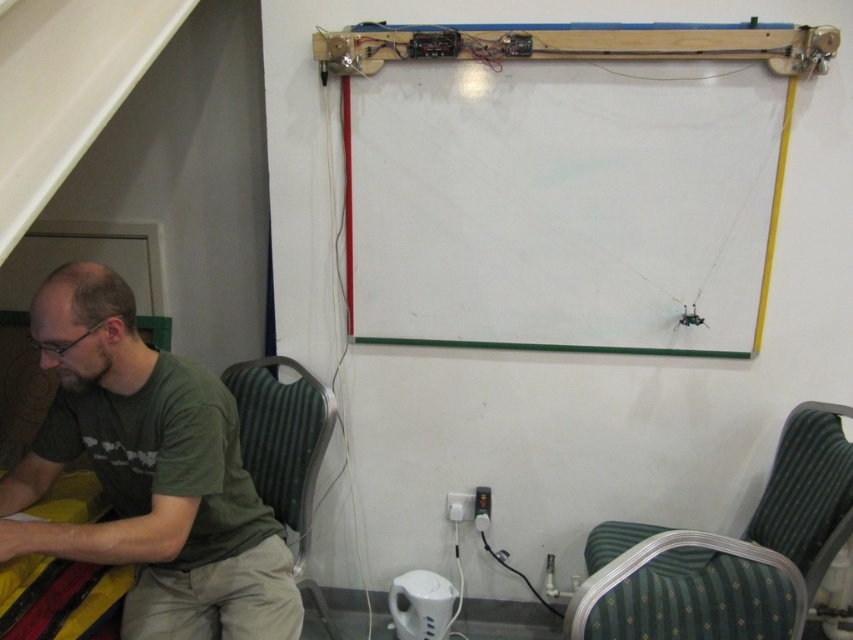
Question: Can you confirm if green fabric chair at lower left is positioned to the left of yellow striped fabric at lower left?

Choices:
 (A) no
 (B) yes

Answer: (A)

Question: Which point is closer to the camera?

Choices:
 (A) green fabric chair at lower left
 (B) green fabric chair at lower right

Answer: (B)

Question: Among these objects, which one is farthest from the camera?

Choices:
 (A) green cotton shirt at lower left
 (B) green fabric chair at lower right

Answer: (B)

Question: Where is green fabric chair at lower right located in relation to yellow striped fabric at lower left in the image?

Choices:
 (A) right
 (B) left

Answer: (A)

Question: Is green cotton shirt at lower left above green fabric chair at lower right?

Choices:
 (A) yes
 (B) no

Answer: (A)

Question: Which object is positioned closest to the green fabric chair at lower left?

Choices:
 (A) green cotton shirt at lower left
 (B) green fabric chair at lower right

Answer: (A)